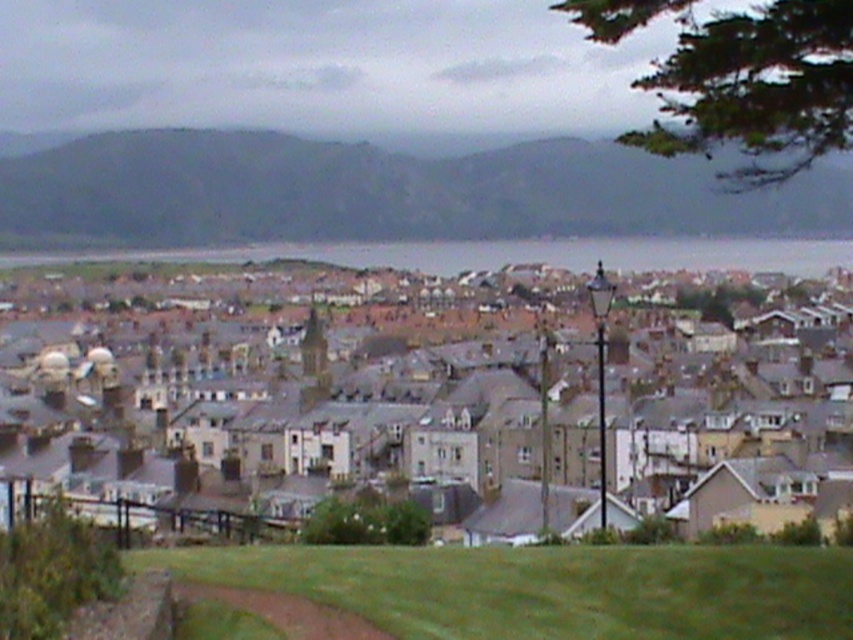
Does green grass at lower center have a greater height compared to gray water at center?

Incorrect, green grass at lower center's height is not larger of gray water at center's.

At what (x,y) coordinates should I click in order to perform the action: click on green grass at lower center. Please return your answer as a coordinate pair (x, y). Looking at the image, I should click on (550, 588).

The height and width of the screenshot is (640, 853). In order to click on green grass at lower center in this screenshot , I will do `click(550, 588)`.

Does point (793, 429) come farther from viewer compared to point (32, 260)?

No, (793, 429) is closer to viewer.

Can you confirm if gray stone houses at center is taller than gray water at center?

Indeed, gray stone houses at center has a greater height compared to gray water at center.

Between point (792, 451) and point (16, 264), which one is positioned behind?

The point (16, 264) is more distant.

Where is `gray stone houses at center`? gray stone houses at center is located at coordinates (454, 387).

Is gray stone houses at center to the left of gray rocky hillside at upper left from the viewer's perspective?

In fact, gray stone houses at center is to the right of gray rocky hillside at upper left.

Can you confirm if gray stone houses at center is wider than gray rocky hillside at upper left?

Answer: Incorrect, gray stone houses at center's width does not surpass gray rocky hillside at upper left's.

Is point (463, 474) closer to camera compared to point (229, 147)?

That is True.

Locate an element on the screen. gray stone houses at center is located at coordinates pyautogui.click(x=454, y=387).